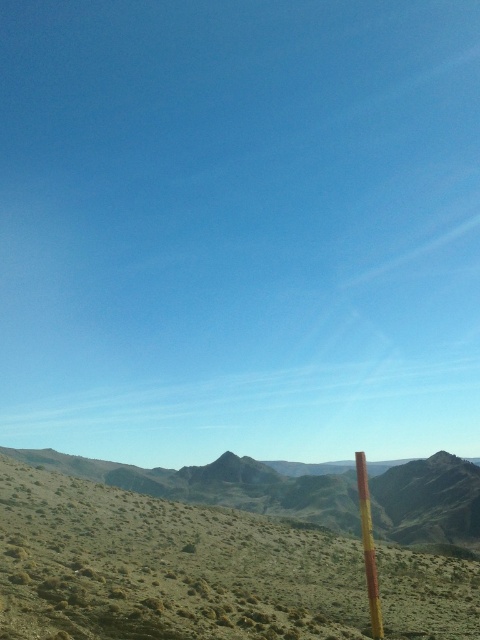
You are standing in the middle of the landscape and want to walk towards the yellow wood pole at right. Which direction should you head to first to avoid the green grassy desert at lower left?

The green grassy desert at lower left is closer to the viewer than the yellow wood pole at right. To avoid it, you should head towards the right direction away from the green grassy desert at lower left and towards the yellow wood pole at right.

You are standing at the center of the landscape and want to walk towards the yellow wood pole at right. Which direction should you head to avoid the green grassy desert at lower left?

To avoid the green grassy desert at lower left, you should head directly towards the yellow wood pole at right since the green grassy desert at lower left is located to the left of the yellow wood pole at right.